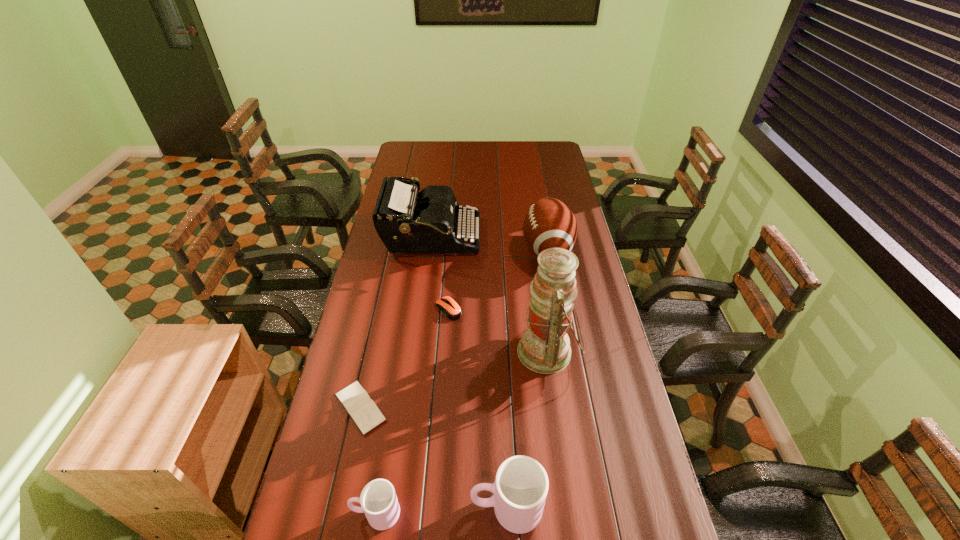
The height and width of the screenshot is (540, 960). Identify the location of vacant region at the near left corner of the desktop. (336, 504).

You are a GUI agent. You are given a task and a screenshot of the screen. Output one action in this format:
    pyautogui.click(x=<x>, y=<y>)
    Task: Click on the empty space that is in between the shortest object and the tallest object
    
    Given the screenshot: What is the action you would take?
    pyautogui.click(x=454, y=380)

You are a GUI agent. You are given a task and a screenshot of the screen. Output one action in this format:
    pyautogui.click(x=<x>, y=<y>)
    Task: Click on the empty space that is in between the fourth tallest object and the shortest object
    
    Given the screenshot: What is the action you would take?
    pyautogui.click(x=434, y=457)

You are a GUI agent. You are given a task and a screenshot of the screen. Output one action in this format:
    pyautogui.click(x=<x>, y=<y>)
    Task: Click on the vacant space that's between the football and the fourth tallest object
    This screenshot has width=960, height=540.
    Given the screenshot: What is the action you would take?
    pyautogui.click(x=527, y=379)

I want to click on vacant space in between the oil lamp and the shorter cup, so click(462, 433).

Find the location of a particular element. This screenshot has width=960, height=540. free spot between the third shortest object and the football is located at coordinates (462, 381).

Where is `vacant space that's between the diary and the fifth nearest object`? The height and width of the screenshot is (540, 960). vacant space that's between the diary and the fifth nearest object is located at coordinates (404, 358).

What are the coordinates of `free space between the diary and the left cup` in the screenshot? It's located at (369, 460).

Identify the location of object that is the third closest to the sixth tallest object. (549, 223).

Select which object is the third closest to the tallest object. Please provide its 2D coordinates. Your answer should be formatted as a tuple, i.e. [(x, y)], where the tuple contains the x and y coordinates of a point satisfying the conditions above.

[(520, 489)]